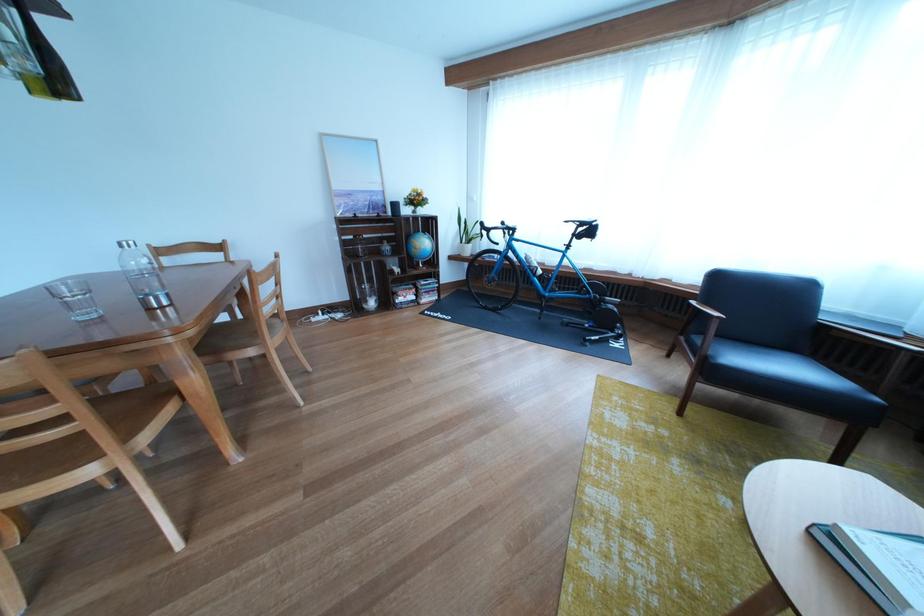
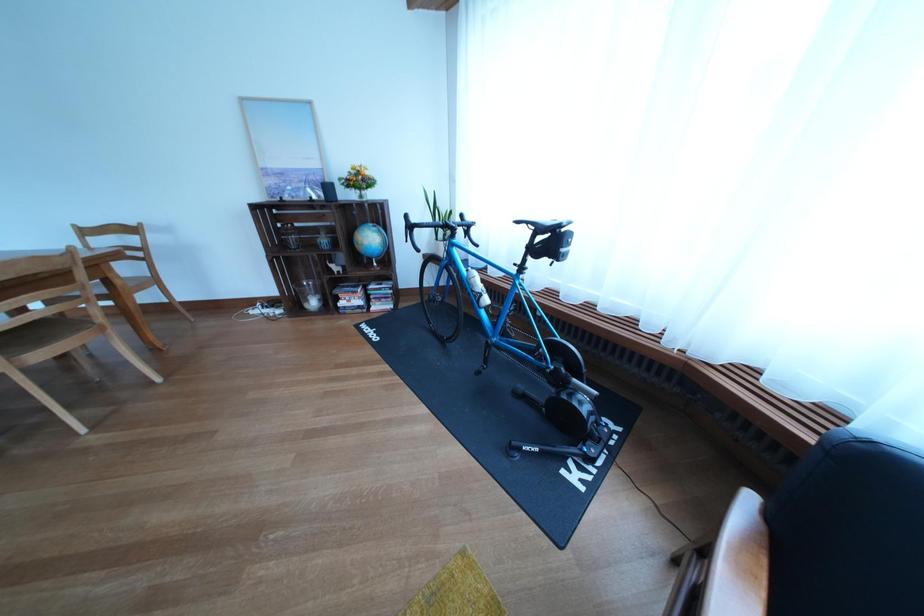
Where in the second image is the point corresponding to [380,307] from the first image?

(321, 306)